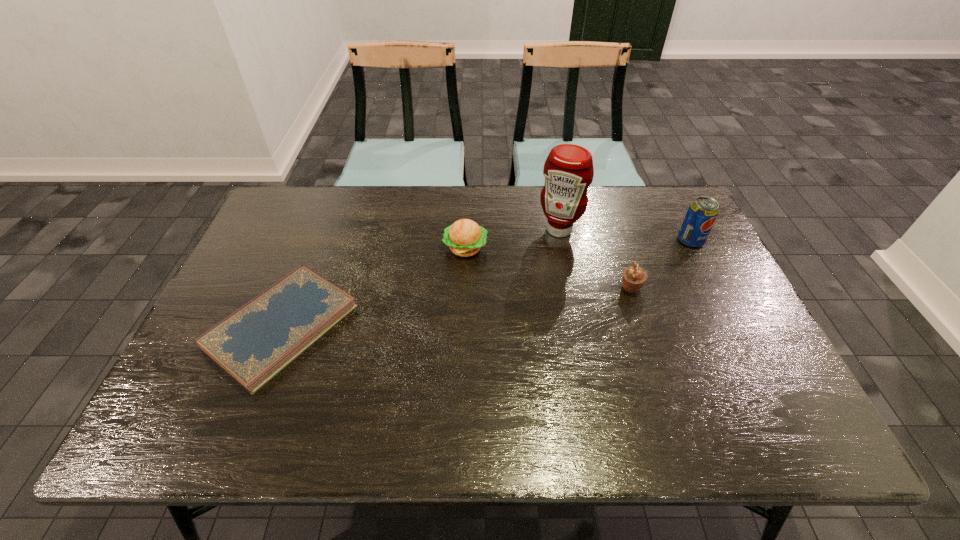
You are a GUI agent. You are given a task and a screenshot of the screen. Output one action in this format:
    pyautogui.click(x=<x>, y=<y>)
    Task: Click on the tallest object
    
    Given the screenshot: What is the action you would take?
    pyautogui.click(x=568, y=170)

You are a GUI agent. You are given a task and a screenshot of the screen. Output one action in this format:
    pyautogui.click(x=<x>, y=<y>)
    Task: Click on the condiment
    The image size is (960, 540).
    Given the screenshot: What is the action you would take?
    pyautogui.click(x=568, y=170)

Where is `soda`? This screenshot has width=960, height=540. soda is located at coordinates (700, 217).

The image size is (960, 540). Identify the location of the second tallest object. click(x=700, y=217).

The height and width of the screenshot is (540, 960). I want to click on the fourth object from right to left, so click(x=465, y=237).

You are a GUI agent. You are given a task and a screenshot of the screen. Output one action in this format:
    pyautogui.click(x=<x>, y=<y>)
    Task: Click on the muffin
    This screenshot has height=540, width=960.
    Given the screenshot: What is the action you would take?
    pyautogui.click(x=634, y=277)

At what (x,y) coordinates should I click in order to perform the action: click on the shortest object. Please return your answer as a coordinate pair (x, y). The image size is (960, 540). Looking at the image, I should click on (253, 344).

You are a GUI agent. You are given a task and a screenshot of the screen. Output one action in this format:
    pyautogui.click(x=<x>, y=<y>)
    Task: Click on the leftmost object
    The height and width of the screenshot is (540, 960).
    Given the screenshot: What is the action you would take?
    pos(253,344)

Where is `vacant region located 0.150m on the left of the third object from right to left`? The image size is (960, 540). vacant region located 0.150m on the left of the third object from right to left is located at coordinates (489, 230).

At what (x,y) coordinates should I click in order to perform the action: click on blank area located 0.340m on the front of the soda. Please return your answer as a coordinate pair (x, y). This screenshot has height=540, width=960. Looking at the image, I should click on (742, 345).